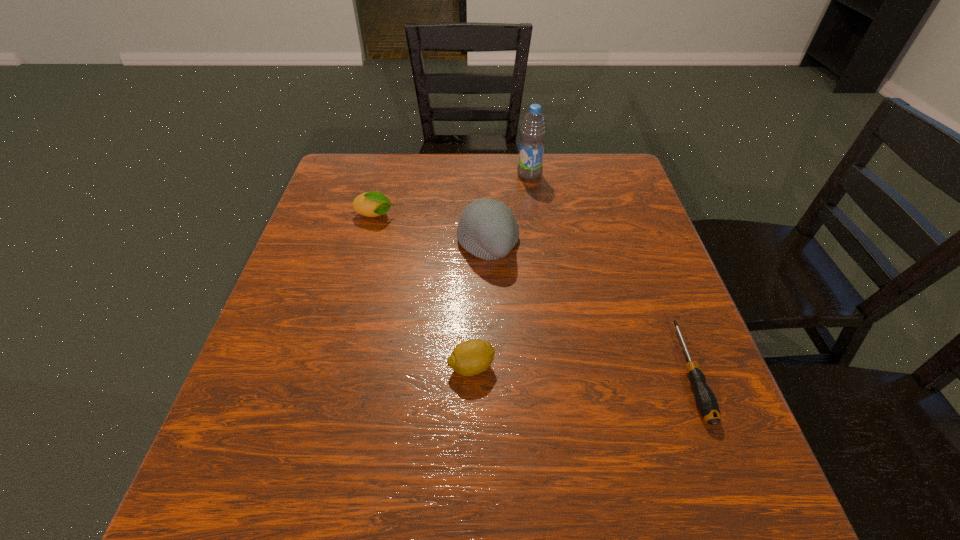
Where is `free space between the water bottle and the rightmost object`? Image resolution: width=960 pixels, height=540 pixels. free space between the water bottle and the rightmost object is located at coordinates coord(610,273).

This screenshot has height=540, width=960. I want to click on vacant space that is in between the fourth shortest object and the farther lemon, so click(x=431, y=230).

Identify the location of the fourth closest object relative to the rightmost object. The height and width of the screenshot is (540, 960). (371, 204).

Image resolution: width=960 pixels, height=540 pixels. Identify the location of the third closest object to the water bottle. (706, 402).

Identify the location of blank area in the image that satisfies the following two spatial constraints: 1. at the stem end of the screwdriver; 2. on the left side of the shorter lemon. Image resolution: width=960 pixels, height=540 pixels. (471, 372).

This screenshot has width=960, height=540. What are the coordinates of `vacant space that satisfies the following two spatial constraints: 1. with leaves positioned above the leftmost object; 2. on the back side of the screwdriver` in the screenshot? It's located at (333, 372).

Where is `free point that satisfies the following two spatial constraints: 1. at the stem end of the right lemon; 2. on the right side of the rightmost object`? free point that satisfies the following two spatial constraints: 1. at the stem end of the right lemon; 2. on the right side of the rightmost object is located at coordinates pyautogui.click(x=471, y=372).

Image resolution: width=960 pixels, height=540 pixels. In order to click on vacant point that satisfies the following two spatial constraints: 1. at the stem end of the screwdriver; 2. on the left side of the nearer lemon in this screenshot , I will do 471,372.

I want to click on free space that satisfies the following two spatial constraints: 1. on the front side of the water bottle; 2. with leaves positioned above the left lemon, so click(x=535, y=216).

At what (x,y) coordinates should I click in order to perform the action: click on blank space that satisfies the following two spatial constraints: 1. with leaves positioned above the second tallest object; 2. on the right side of the leftmost object. Please return your answer as a coordinate pair (x, y). Image resolution: width=960 pixels, height=540 pixels. Looking at the image, I should click on tap(368, 244).